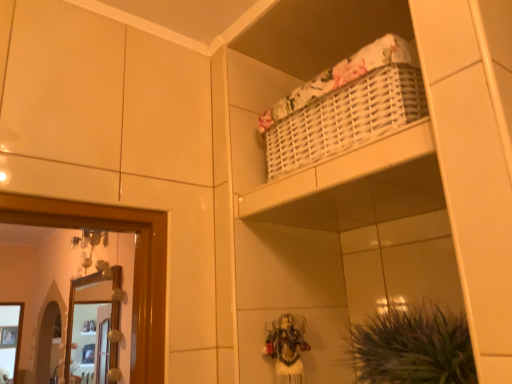
Question: Relative to green leafy plant at lower right, is wooden framed mirror at left in front or behind?

Choices:
 (A) behind
 (B) front

Answer: (A)

Question: In terms of width, does wooden framed mirror at left look wider or thinner when compared to green leafy plant at lower right?

Choices:
 (A) thin
 (B) wide

Answer: (A)

Question: Considering the positions of wooden framed mirror at left and green leafy plant at lower right in the image, is wooden framed mirror at left taller or shorter than green leafy plant at lower right?

Choices:
 (A) short
 (B) tall

Answer: (B)

Question: Would you say green leafy plant at lower right is to the left or to the right of wooden framed mirror at left in the picture?

Choices:
 (A) left
 (B) right

Answer: (B)

Question: Considering their positions, is green leafy plant at lower right located in front of or behind wooden framed mirror at left?

Choices:
 (A) behind
 (B) front

Answer: (B)

Question: From a real-world perspective, is green leafy plant at lower right physically located above or below wooden framed mirror at left?

Choices:
 (A) below
 (B) above

Answer: (A)

Question: Is green leafy plant at lower right spatially inside wooden framed mirror at left, or outside of it?

Choices:
 (A) outside
 (B) inside

Answer: (A)